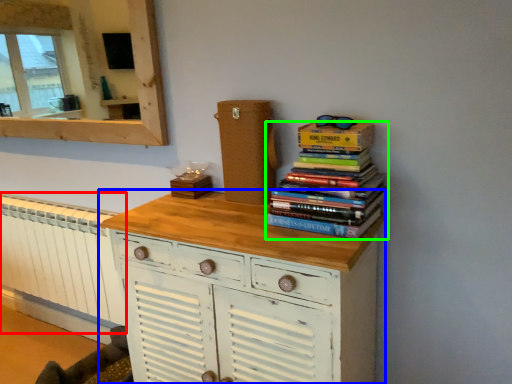
Question: Based on their relative distances, which object is nearer to radiator (highlighted by a red box)? Choose from chest of drawers (highlighted by a blue box) and book (highlighted by a green box).

Choices:
 (A) chest of drawers
 (B) book

Answer: (A)